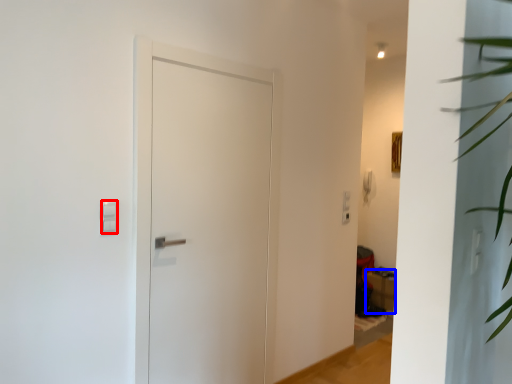
Question: Which object appears closest to the camera in this image, light switch (highlighted by a red box) or furniture (highlighted by a blue box)?

Choices:
 (A) light switch
 (B) furniture

Answer: (A)